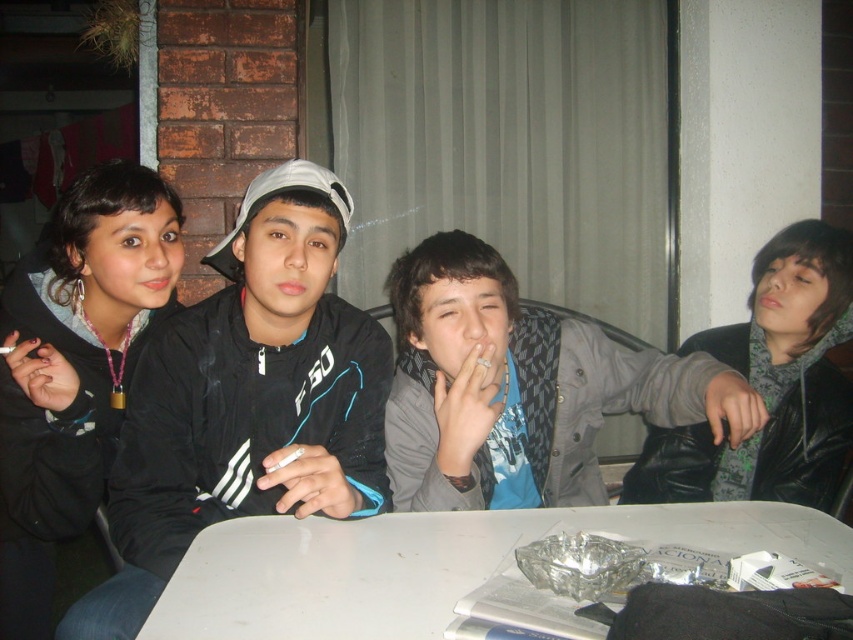
You are a waiter at this outdoor event and need to place a 12 inch long tray on the white plastic table at lower center. Can you fit the tray on the table without it overlapping the black matte jacket at center based on the distance provided?

The distance between the black matte jacket at center and the white plastic table at lower center is 10.40 inches. Since the tray is 12 inches long, it would extend beyond the 10.40 inch gap, so the tray cannot be placed without overlapping the jacket.

You are a photographer setting up for a group photo. You have two jackets, the black matte jacket at center and the gray matte jacket at center, which are currently 9.78 inches apart. If your camera has a minimum focus distance of 10 inches, will you be able to capture both jackets clearly in the photo without moving them?

The black matte jacket at center and the gray matte jacket at center are 9.78 inches apart, which is less than the camera minimum focus distance of 10 inches. Therefore, you will not be able to capture both jackets clearly without moving them closer together or further apart to meet the required distance.

In the scene shown: You are planning to place a new decorative item on the white plastic table at lower center. However, you notice the black matte jacket at center is currently occupying space there. Based on their sizes, will the jacket block the entire table surface?

The black matte jacket at center is bigger than the white plastic table at lower center, so it will block the entire table surface.